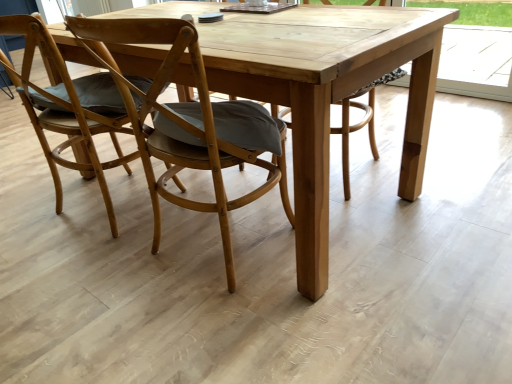
Question: Is natural wood picnic table at center to the right of wooden chair with cushion at center, which is the 1th chair in right-to-left order, from the viewer's perspective?

Choices:
 (A) no
 (B) yes

Answer: (B)

Question: Can you confirm if natural wood picnic table at center is shorter than wooden chair with cushion at center, which is the 1th chair in right-to-left order?

Choices:
 (A) yes
 (B) no

Answer: (A)

Question: Could you tell me if natural wood picnic table at center is facing wooden chair with cushion at center, which is the 1th chair in right-to-left order?

Choices:
 (A) no
 (B) yes

Answer: (B)

Question: Considering the relative sizes of natural wood picnic table at center and wooden chair with cushion at center, which is the 2th chair from left to right, in the image provided, is natural wood picnic table at center taller than wooden chair with cushion at center, which is the 2th chair from left to right,?

Choices:
 (A) yes
 (B) no

Answer: (B)

Question: From a real-world perspective, is natural wood picnic table at center over wooden chair with cushion at center, which is the 2th chair from left to right?

Choices:
 (A) no
 (B) yes

Answer: (A)

Question: Does natural wood picnic table at center lie behind wooden chair with cushion at center, which is the 2th chair from left to right?

Choices:
 (A) yes
 (B) no

Answer: (A)

Question: Considering the relative sizes of natural wood picnic table at center and wooden chair at left, positioned as the 1th chair in left-to-right order, in the image provided, is natural wood picnic table at center shorter than wooden chair at left, positioned as the 1th chair in left-to-right order,?

Choices:
 (A) yes
 (B) no

Answer: (A)

Question: Is natural wood picnic table at center at the right side of wooden chair at left, marked as the 2th chair in a right-to-left arrangement?

Choices:
 (A) no
 (B) yes

Answer: (B)

Question: From a real-world perspective, is natural wood picnic table at center physically above wooden chair at left, marked as the 2th chair in a right-to-left arrangement?

Choices:
 (A) yes
 (B) no

Answer: (B)

Question: From the image's perspective, does natural wood picnic table at center appear lower than wooden chair at left, positioned as the 1th chair in left-to-right order?

Choices:
 (A) yes
 (B) no

Answer: (B)

Question: Is natural wood picnic table at center facing towards wooden chair at left, marked as the 2th chair in a right-to-left arrangement?

Choices:
 (A) no
 (B) yes

Answer: (B)

Question: Are natural wood picnic table at center and wooden chair at left, positioned as the 1th chair in left-to-right order, located far from each other?

Choices:
 (A) yes
 (B) no

Answer: (B)

Question: Is wooden chair with cushion at center, which is the 1th chair in right-to-left order, thinner than natural wood picnic table at center?

Choices:
 (A) no
 (B) yes

Answer: (B)